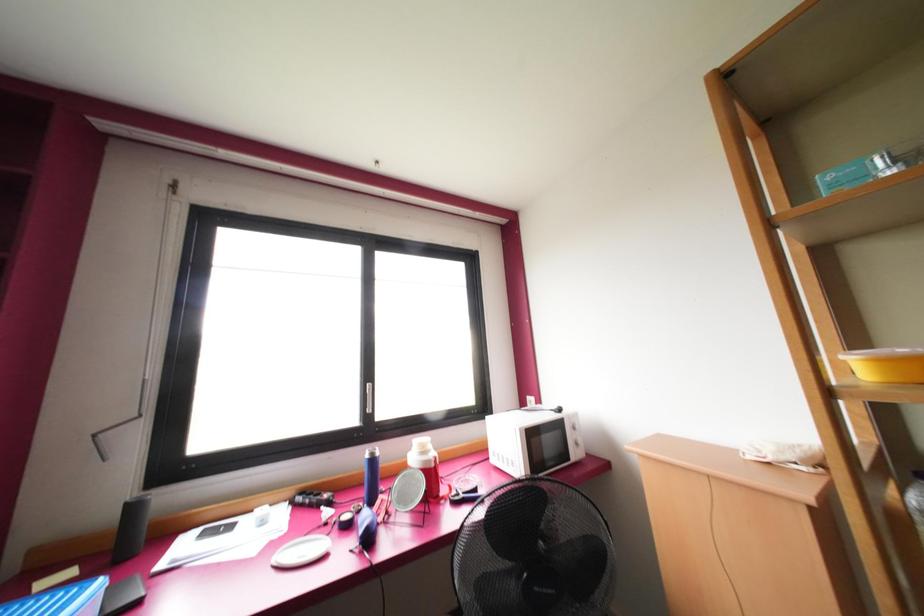
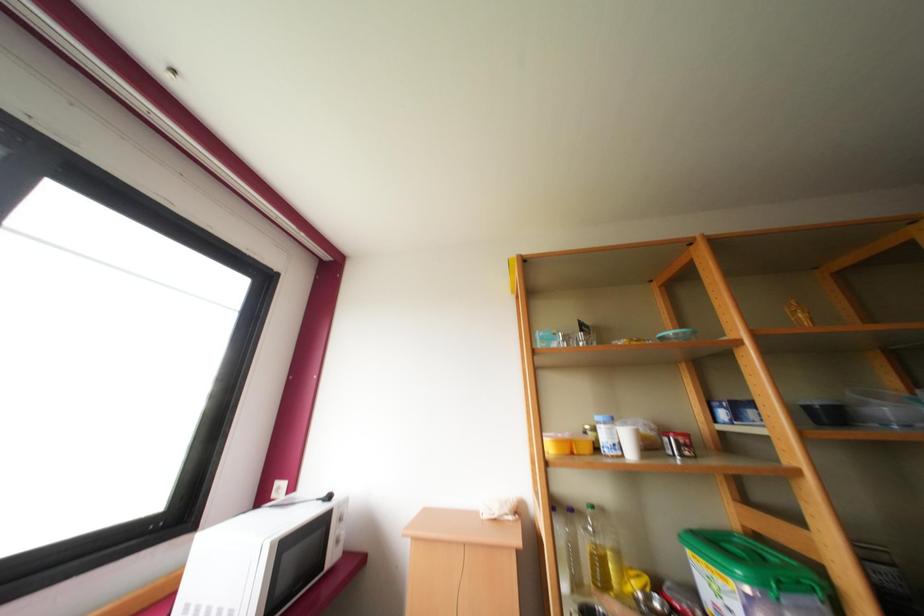
How did the camera likely rotate?

The rotation direction of the camera is right-up.